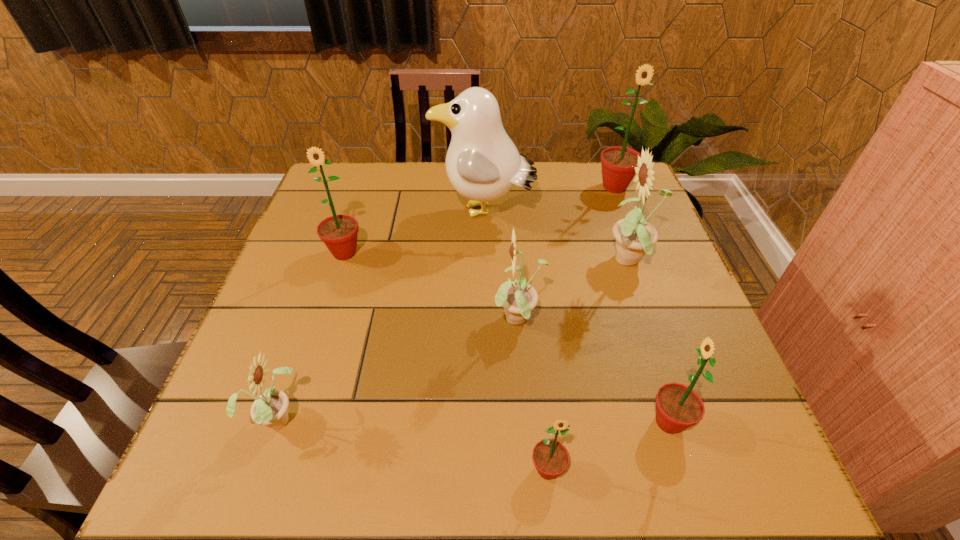
The image size is (960, 540). In order to click on gull that is at the far edge in this screenshot , I will do `click(482, 163)`.

The width and height of the screenshot is (960, 540). In order to click on object located at the near edge in this screenshot , I will do `click(550, 457)`.

Locate an element on the screen. The image size is (960, 540). object present at the far right corner is located at coordinates (618, 164).

In the image, there is a desktop. In order to click on vacant area at the far edge in this screenshot , I will do `click(401, 185)`.

Find the location of a particular element. free spot at the near edge of the desktop is located at coordinates click(411, 498).

Identify the location of vacant space at the left edge. The height and width of the screenshot is (540, 960). (296, 265).

In the image, there is a desktop. Where is `free space at the right edge`? The image size is (960, 540). free space at the right edge is located at coordinates (708, 420).

Where is `vacant point at the far left corner`? This screenshot has width=960, height=540. vacant point at the far left corner is located at coordinates (341, 180).

This screenshot has height=540, width=960. Find the location of `free location at the near right corner of the desktop`. free location at the near right corner of the desktop is located at coordinates (758, 471).

Where is `vacant region between the third biggest green sunflower and the nearest object`? vacant region between the third biggest green sunflower and the nearest object is located at coordinates (608, 446).